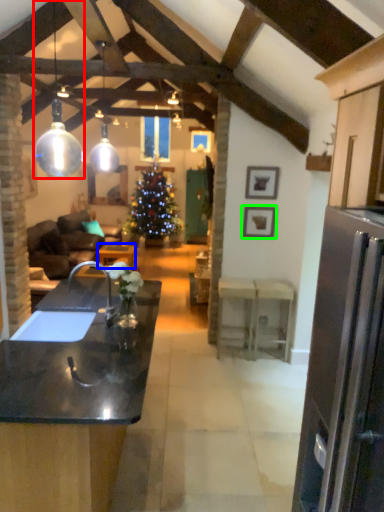
Question: Considering the real-world distances, which object is farthest from lamp (highlighted by a red box)? table (highlighted by a blue box) or picture frame (highlighted by a green box)?

Choices:
 (A) table
 (B) picture frame

Answer: (A)